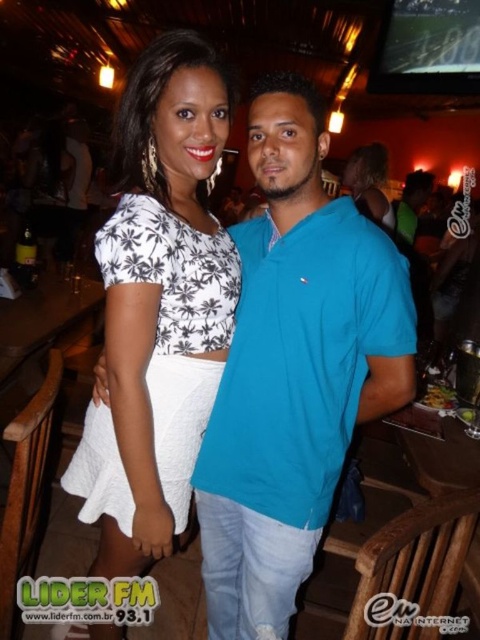
You are a photographer setting up for a group photo. You notice the blue cotton shirt at center and the matte black dress at center. Which one is positioned to the left side from your perspective?

The blue cotton shirt at center is positioned to the left of the matte black dress at center.

You are standing at the origin point in the image and want to move towards the two points labeled point (159, 141) and point (380, 179). Which point should you reach first?

Point (159, 141) is in front of point (380, 179), so you will reach point (159, 141) first.

What is the exact location of the white textured skirt at center in the image?

The white textured skirt at center is located at point coordinates of (158, 305).